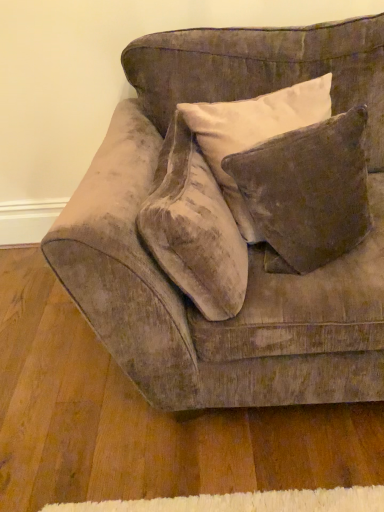
What do you see at coordinates (310, 188) in the screenshot? The image size is (384, 512). I see `velvet brown pillow at upper right` at bounding box center [310, 188].

The width and height of the screenshot is (384, 512). What do you see at coordinates (194, 228) in the screenshot?
I see `velvet beige throw pillow at center` at bounding box center [194, 228].

Find the location of `velvet brown pillow at upper right`. velvet brown pillow at upper right is located at coordinates (310, 188).

Identify the location of pillow lying above the velvet couch at center (from the image's perspective). (310, 188).

From the image's perspective, which object appears higher, velvet couch at center or velvet brown pillow at upper right?

velvet brown pillow at upper right appears higher in the image.

Is velvet couch at center to the right of velvet brown pillow at upper right from the viewer's perspective?

No, velvet couch at center is not to the right of velvet brown pillow at upper right.

Looking at this image, how distant is velvet couch at center from velvet brown pillow at upper right?

8.48 inches.

Does velvet brown pillow at upper right have a smaller size compared to velvet beige throw pillow at center?

Indeed, velvet brown pillow at upper right has a smaller size compared to velvet beige throw pillow at center.

From the image's perspective, is velvet brown pillow at upper right located beneath velvet beige throw pillow at center?

No, from the image's perspective, velvet brown pillow at upper right is not beneath velvet beige throw pillow at center.

Where is `throw pillow that appears in front of the velvet brown pillow at upper right`? This screenshot has width=384, height=512. throw pillow that appears in front of the velvet brown pillow at upper right is located at coordinates (194, 228).

Based on the photo, based on their positions, is velvet beige throw pillow at center located to the left or right of velvet brown pillow at upper right?

In the image, velvet beige throw pillow at center appears on the left side of velvet brown pillow at upper right.

From a real-world perspective, which is physically below, velvet beige throw pillow at center or velvet brown pillow at upper right?

velvet beige throw pillow at center.

Looking at their sizes, would you say velvet beige throw pillow at center is wider or thinner than velvet brown pillow at upper right?

Clearly, velvet beige throw pillow at center has less width compared to velvet brown pillow at upper right.

Do you think velvet beige throw pillow at center is within velvet brown pillow at upper right, or outside of it?

velvet beige throw pillow at center is not enclosed by velvet brown pillow at upper right.

How much distance is there between velvet couch at center and velvet beige throw pillow at center?

velvet couch at center is 6.38 inches away from velvet beige throw pillow at center.

Is velvet couch at center outside of velvet beige throw pillow at center?

Absolutely, velvet couch at center is external to velvet beige throw pillow at center.

From the image's perspective, which one is positioned higher, velvet couch at center or velvet beige throw pillow at center?

velvet couch at center is shown above in the image.

Is velvet couch at center bigger than velvet beige throw pillow at center?

Yes.

Can you confirm if velvet brown pillow at upper right is smaller than velvet couch at center?

Indeed, velvet brown pillow at upper right has a smaller size compared to velvet couch at center.

How many degrees apart are the facing directions of velvet brown pillow at upper right and velvet couch at center?

The angle between the facing direction of velvet brown pillow at upper right and the facing direction of velvet couch at center is 18.9 degrees.

Is velvet couch at center located within velvet brown pillow at upper right?

No, velvet couch at center is not inside velvet brown pillow at upper right.

Does velvet brown pillow at upper right appear on the right side of velvet couch at center?

Yes.

Is point (153, 215) positioned after point (148, 384)?

That is False.

Is velvet beige throw pillow at center directly adjacent to velvet couch at center?

No, velvet beige throw pillow at center is not touching velvet couch at center.

From a real-world perspective, which is physically below, velvet beige throw pillow at center or velvet couch at center?

velvet couch at center, from a real-world perspective.

Between velvet beige throw pillow at center and velvet couch at center, which one has more height?

velvet couch at center.

Find the location of `pillow above the velvet couch at center (from the image's perspective)`. pillow above the velvet couch at center (from the image's perspective) is located at coordinates (310, 188).

Where is `throw pillow in front of the velvet brown pillow at upper right`? Image resolution: width=384 pixels, height=512 pixels. throw pillow in front of the velvet brown pillow at upper right is located at coordinates (194, 228).

Estimate the real-world distances between objects in this image. Which object is further from velvet brown pillow at upper right, velvet beige throw pillow at center or velvet couch at center?

Among the two, velvet couch at center is located further to velvet brown pillow at upper right.

From the image, which object appears to be farther from velvet beige throw pillow at center, velvet brown pillow at upper right or velvet couch at center?

velvet brown pillow at upper right.

Based on the photo, estimate the real-world distances between objects in this image. Which object is further from velvet couch at center, velvet beige throw pillow at center or velvet brown pillow at upper right?

Based on the image, velvet brown pillow at upper right appears to be further to velvet couch at center.

When comparing their distances from velvet brown pillow at upper right, does velvet couch at center or velvet beige throw pillow at center seem further?

Among the two, velvet couch at center is located further to velvet brown pillow at upper right.

Which object lies nearer to the anchor point velvet couch at center, velvet brown pillow at upper right or velvet beige throw pillow at center?

Based on the image, velvet beige throw pillow at center appears to be nearer to velvet couch at center.

Based on their spatial positions, is velvet couch at center or velvet brown pillow at upper right closer to velvet beige throw pillow at center?

Based on the image, velvet couch at center appears to be nearer to velvet beige throw pillow at center.

The image size is (384, 512). I want to click on studio couch between velvet beige throw pillow at center and velvet brown pillow at upper right, so click(249, 246).